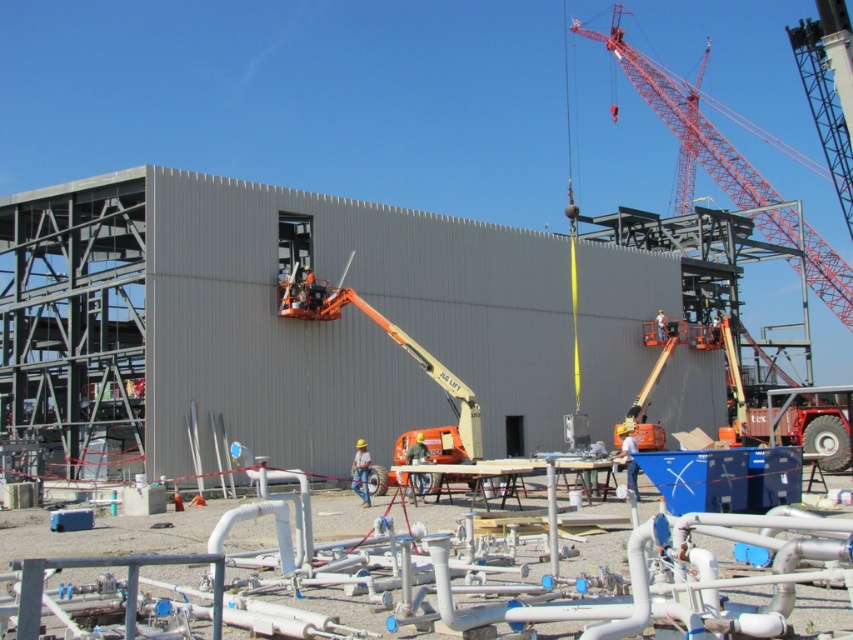
Question: Is red metallic crane at upper right in front of orange metallic lift at center?

Choices:
 (A) yes
 (B) no

Answer: (B)

Question: Can you confirm if red metallic crane at upper right is positioned below orange metallic lift at center?

Choices:
 (A) no
 (B) yes

Answer: (A)

Question: Is red metallic crane at upper right to the right of orange metallic lift at center from the viewer's perspective?

Choices:
 (A) yes
 (B) no

Answer: (A)

Question: Which point appears closest to the camera in this image?

Choices:
 (A) (344, 304)
 (B) (635, 70)

Answer: (A)